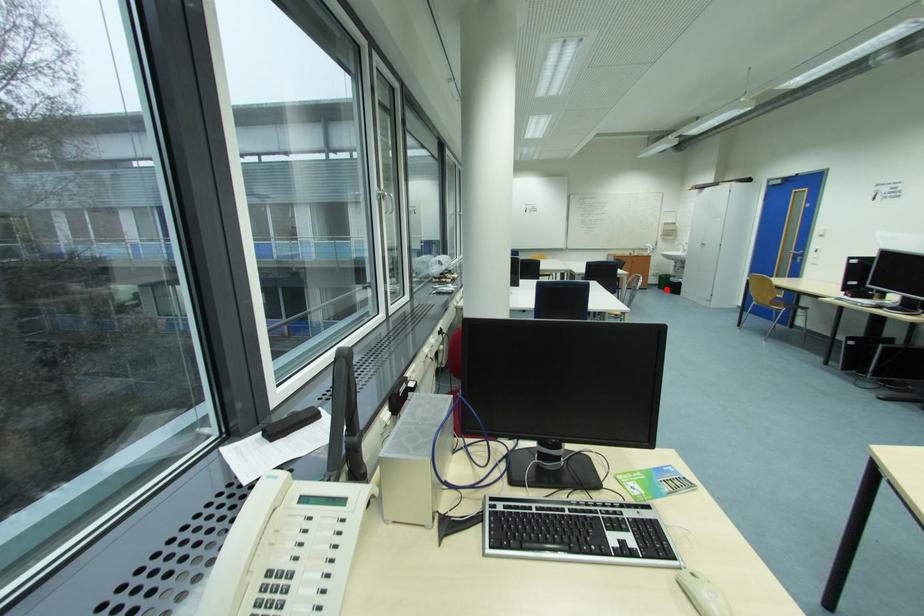
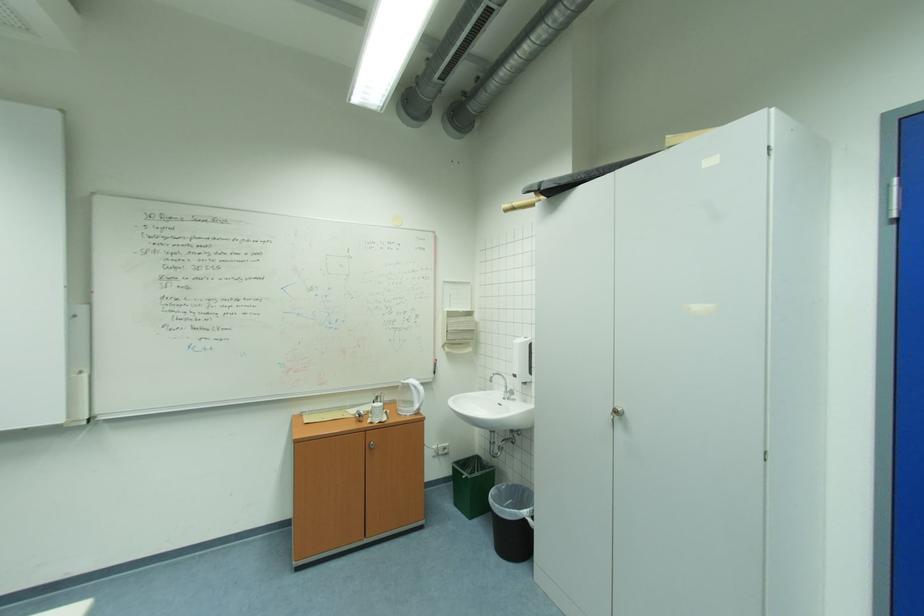
Question: I am providing you with two images of the same scene from different viewpoints. Image1 has a red point marked. In image2, the corresponding 3D location appears at what relative position? Reply with the corresponding letter.

Choices:
 (A) Closer
 (B) Farther

Answer: (A)